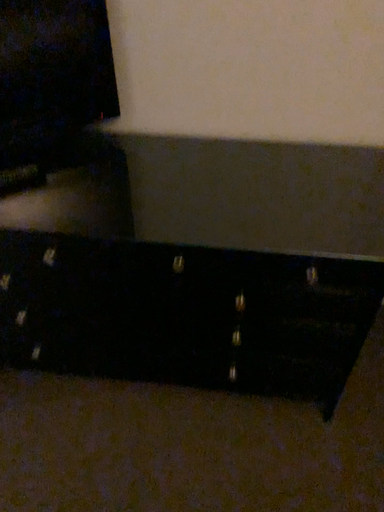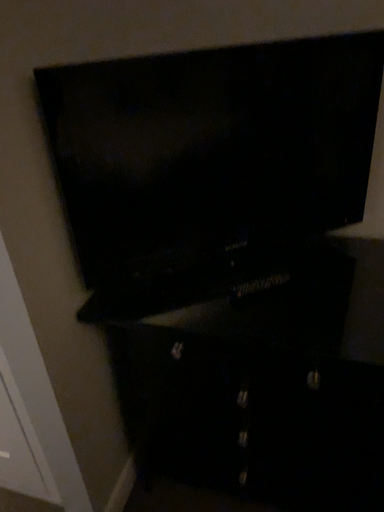
Question: Which way did the camera rotate in the video?

Choices:
 (A) rotated left
 (B) rotated right

Answer: (A)